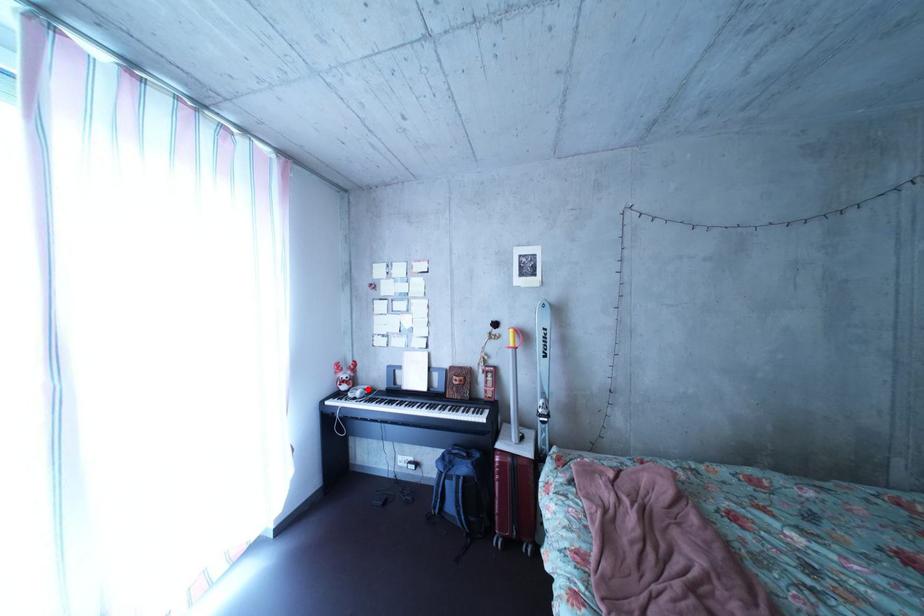
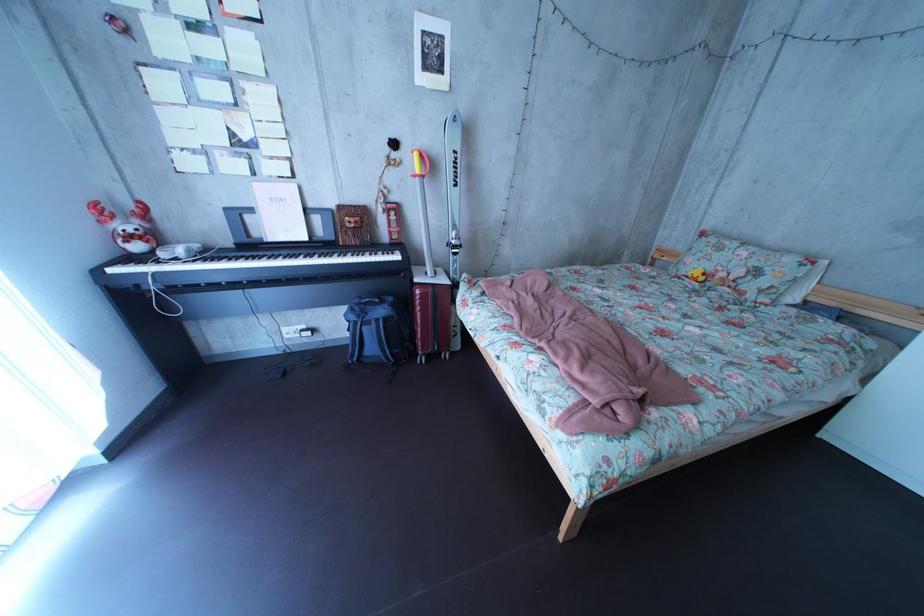
Question: A red point is marked in image1. In image2, is the corresponding 3D point closer to the camera or farther? Reply with the corresponding letter.

Choices:
 (A) The corresponding 3D point is closer.
 (B) The corresponding 3D point is farther.

Answer: (A)